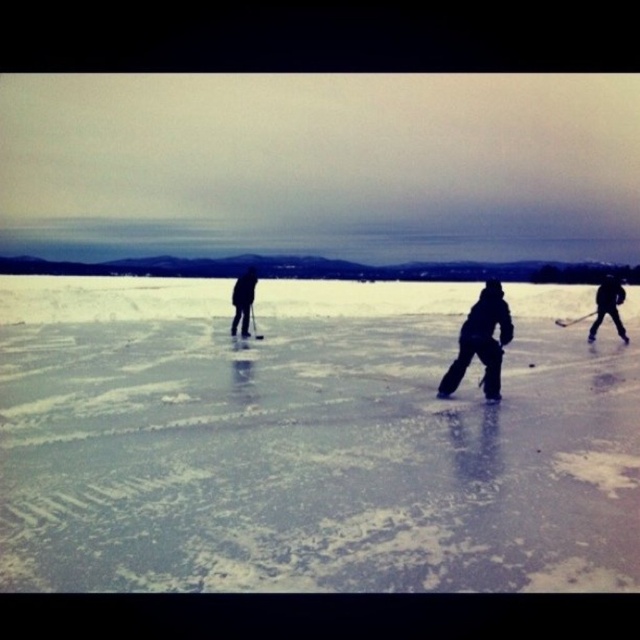
Can you confirm if dark gray ice skates at center is positioned below black matte hockey at center?

Correct, dark gray ice skates at center is located below black matte hockey at center.

Does dark gray ice skates at center appear over black matte hockey at center?

Incorrect, dark gray ice skates at center is not positioned above black matte hockey at center.

Does point (273, 483) come behind point (256, 333)?

No.

Find the location of a particular element. dark gray ice skates at center is located at coordinates point(308,442).

Which is more to the left, dark gray fabric jacket at center or black matte hockey stick at right?

dark gray fabric jacket at center is more to the left.

Is dark gray fabric jacket at center to the right of black matte hockey stick at right from the viewer's perspective?

Incorrect, dark gray fabric jacket at center is not on the right side of black matte hockey stick at right.

Between point (248, 292) and point (570, 323), which one is positioned in front?

Positioned in front is point (248, 292).

Locate an element on the screen. This screenshot has width=640, height=640. dark gray fabric jacket at center is located at coordinates (243, 300).

Is dark gray fabric jacket at center above black matte hockey at center?

Yes.

Is point (244, 321) farther from camera compared to point (253, 330)?

That is False.

Is point (237, 285) farther from camera compared to point (252, 304)?

That is False.

You are a GUI agent. You are given a task and a screenshot of the screen. Output one action in this format:
    pyautogui.click(x=<x>, y=<y>)
    Task: Click on the dark gray fabric jacket at center
    The width and height of the screenshot is (640, 640).
    Given the screenshot: What is the action you would take?
    pyautogui.click(x=243, y=300)